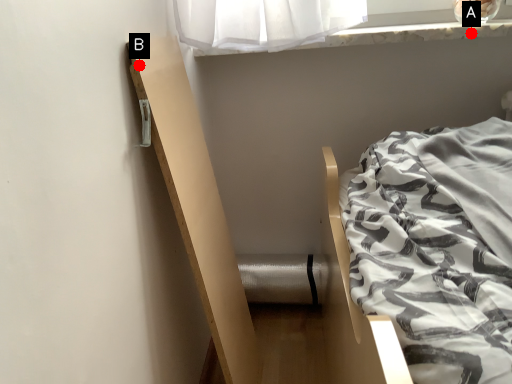
Question: Two points are circled on the image, labeled by A and B beside each circle. Which point is further to the camera?

Choices:
 (A) A is further
 (B) B is further

Answer: (A)